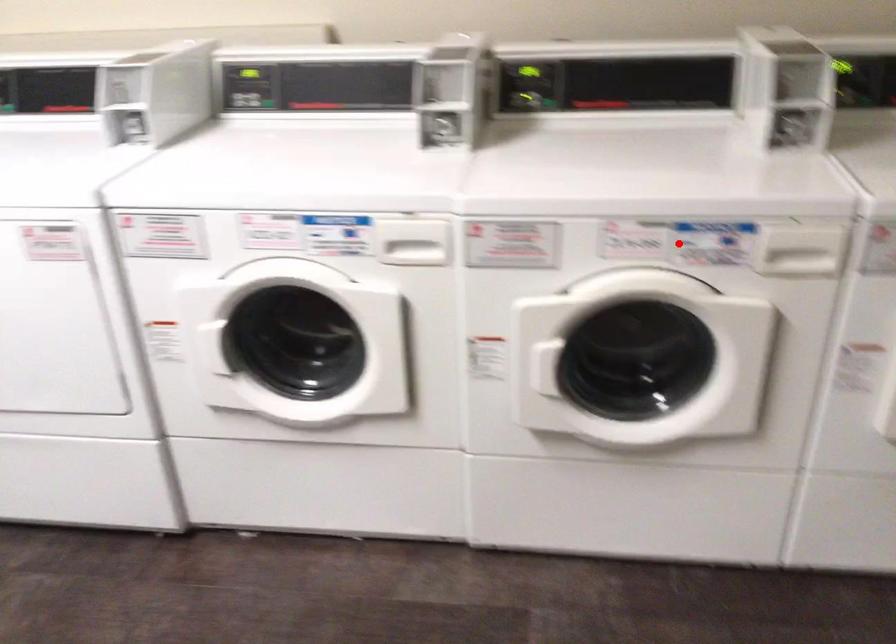
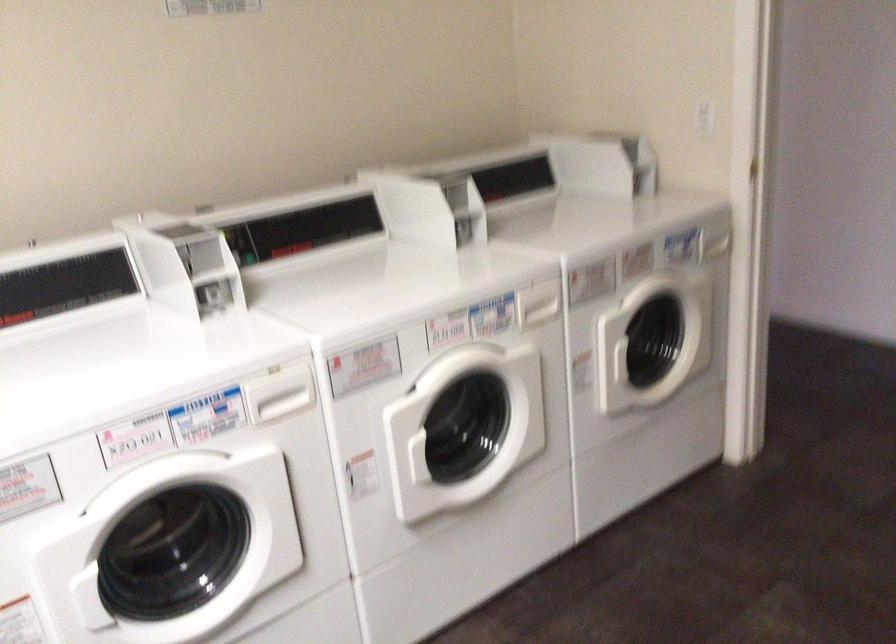
Question: I am providing you with two images of the same scene from different viewpoints. In image1, a red point is highlighted. Considering the same 3D point in image2, which of the following is correct?

Choices:
 (A) It is closer
 (B) It is farther

Answer: (B)